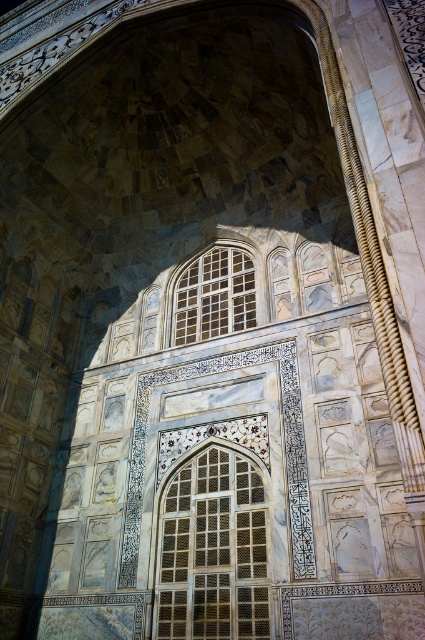
Is matte glass window at center smaller than translucent glass window at center?

Actually, matte glass window at center might be larger than translucent glass window at center.

Is matte glass window at center below translucent glass window at center?

Correct, matte glass window at center is located below translucent glass window at center.

Image resolution: width=425 pixels, height=640 pixels. I want to click on matte glass window at center, so [214, 550].